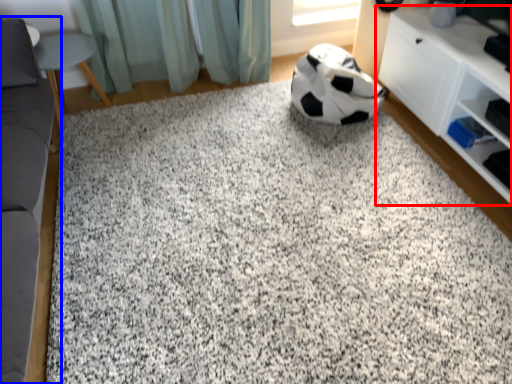
Question: Among these objects, which one is nearest to the camera, shelf (highlighted by a red box) or furniture (highlighted by a blue box)?

Choices:
 (A) shelf
 (B) furniture

Answer: (B)